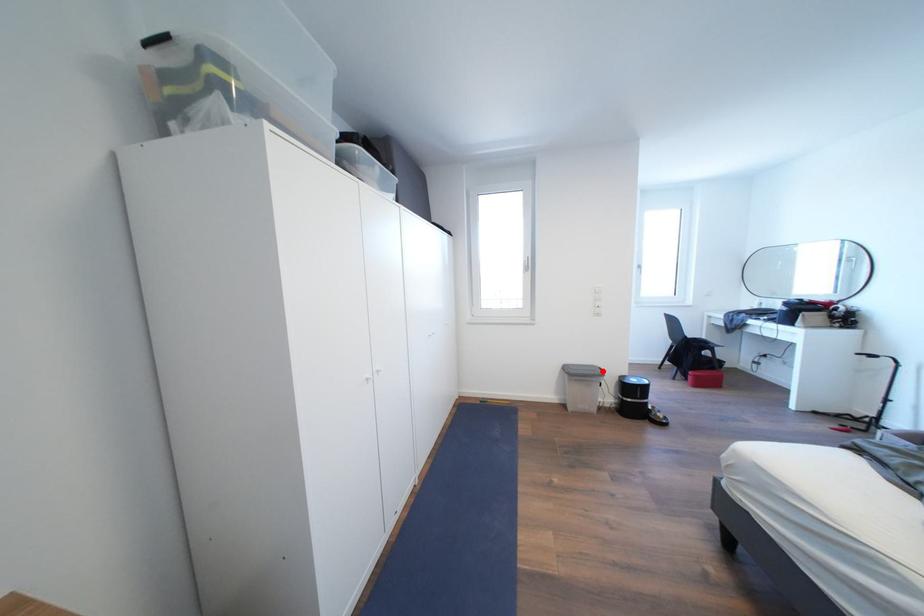
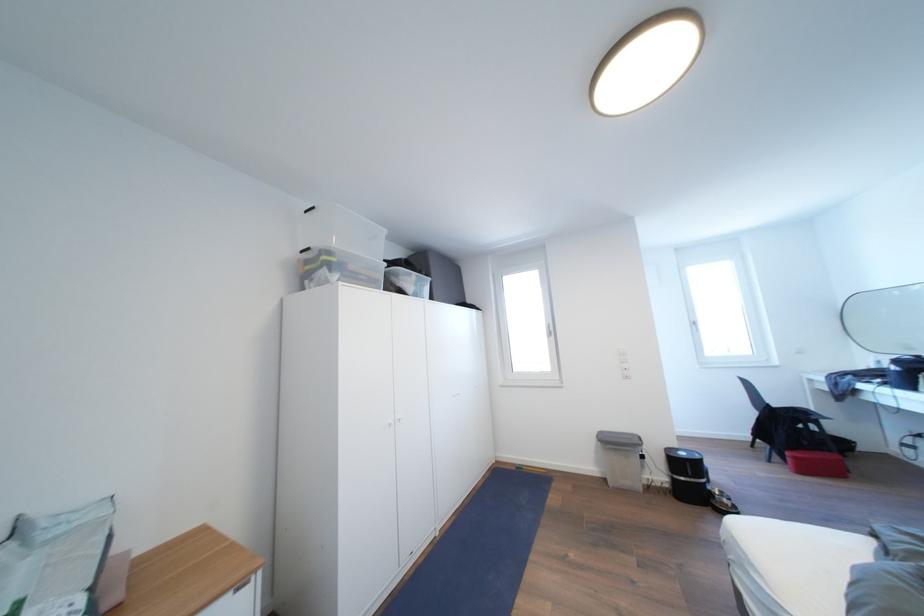
The point at the highlighted location is marked in the first image. Where is the corresponding point in the second image?

(639, 440)